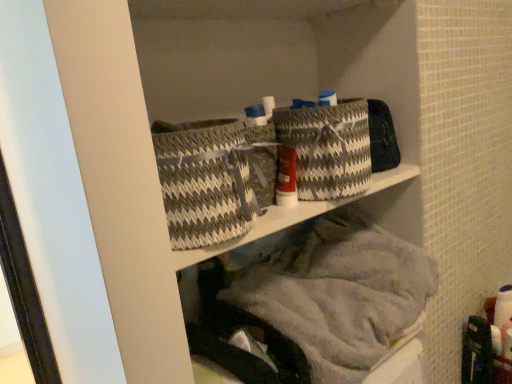
Question: Relative to gray woven baskets at upper center, is gray and white woven basket at center, which ranks as the second basket in left-to-right order, in front or behind?

Choices:
 (A) front
 (B) behind

Answer: (B)

Question: Is gray and white woven basket at center, which ranks as the second basket in left-to-right order, to the left or to the right of gray woven baskets at upper center in the image?

Choices:
 (A) left
 (B) right

Answer: (B)

Question: Which is farther from the gray and white woven basket at center, which ranks as the second basket in left-to-right order?

Choices:
 (A) gray woven basket at center, the first basket positioned from the left
 (B) white plastic can at center
 (C) gray woven baskets at upper center

Answer: (C)

Question: Estimate the real-world distances between objects in this image. Which object is closer to the gray woven basket at center, the first basket positioned from the left?

Choices:
 (A) gray woven baskets at upper center
 (B) white plastic can at center
 (C) gray and white woven basket at center, which is the first basket from right to left

Answer: (B)